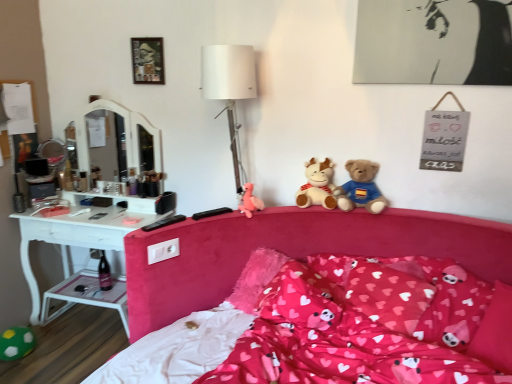
The width and height of the screenshot is (512, 384). I want to click on space that is in front of fluffy pink pillow at center, which appears as the first pillow when viewed from the left, so click(322, 354).